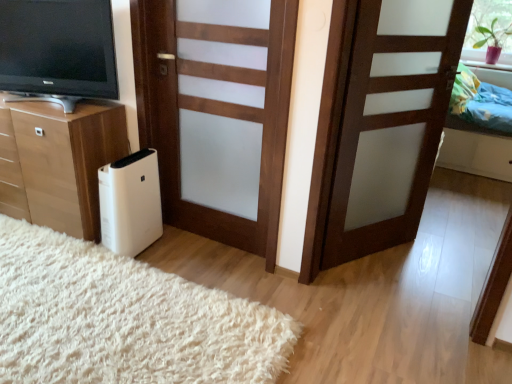
Question: Can you confirm if multicolored fabric bed at upper right is smaller than matte black television at left?

Choices:
 (A) no
 (B) yes

Answer: (A)

Question: Can you confirm if multicolored fabric bed at upper right is thinner than matte black television at left?

Choices:
 (A) no
 (B) yes

Answer: (A)

Question: Does multicolored fabric bed at upper right lie behind matte black television at left?

Choices:
 (A) no
 (B) yes

Answer: (B)

Question: Is multicolored fabric bed at upper right shorter than matte black television at left?

Choices:
 (A) no
 (B) yes

Answer: (A)

Question: Can you confirm if multicolored fabric bed at upper right is taller than matte black television at left?

Choices:
 (A) no
 (B) yes

Answer: (B)

Question: Is multicolored fabric bed at upper right with matte black television at left?

Choices:
 (A) no
 (B) yes

Answer: (A)

Question: Is green matte plant at upper right at the right side of brown matte door at center, which is the second door in left-to-right order?

Choices:
 (A) no
 (B) yes

Answer: (B)

Question: Is green matte plant at upper right directly adjacent to brown matte door at center, which is the second door in left-to-right order?

Choices:
 (A) yes
 (B) no

Answer: (B)

Question: Is green matte plant at upper right oriented away from brown matte door at center, which appears as the first door when viewed from the right?

Choices:
 (A) yes
 (B) no

Answer: (B)

Question: Considering the relative sizes of green matte plant at upper right and brown matte door at center, which appears as the first door when viewed from the right, in the image provided, is green matte plant at upper right shorter than brown matte door at center, which appears as the first door when viewed from the right,?

Choices:
 (A) yes
 (B) no

Answer: (A)

Question: Can you confirm if green matte plant at upper right is taller than brown matte door at center, which appears as the first door when viewed from the right?

Choices:
 (A) no
 (B) yes

Answer: (A)

Question: From a real-world perspective, does green matte plant at upper right sit lower than brown matte door at center, which appears as the first door when viewed from the right?

Choices:
 (A) no
 (B) yes

Answer: (A)

Question: Is brown matte door at center, which is the second door in left-to-right order, at the right side of white soft rug at lower left?

Choices:
 (A) yes
 (B) no

Answer: (A)